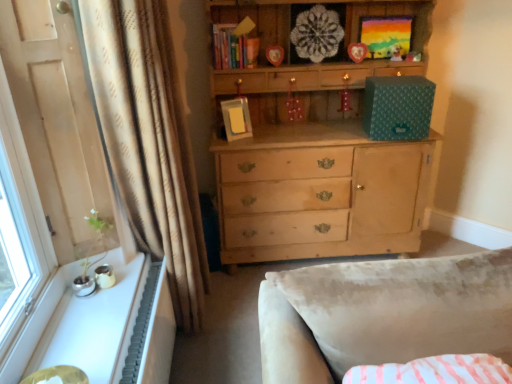
Question: Should I look upward or downward to see white glossy windowsill at lower left?

Choices:
 (A) down
 (B) up

Answer: (A)

Question: Is white textured radiator at lower left aimed at white glossy windowsill at lower left?

Choices:
 (A) yes
 (B) no

Answer: (B)

Question: Can you confirm if white textured radiator at lower left is taller than white glossy windowsill at lower left?

Choices:
 (A) yes
 (B) no

Answer: (A)

Question: Does white textured radiator at lower left have a lesser height compared to white glossy windowsill at lower left?

Choices:
 (A) yes
 (B) no

Answer: (B)

Question: Is white textured radiator at lower left not within white glossy windowsill at lower left?

Choices:
 (A) no
 (B) yes

Answer: (B)

Question: Can you confirm if white textured radiator at lower left is bigger than white glossy windowsill at lower left?

Choices:
 (A) yes
 (B) no

Answer: (A)

Question: From the image's perspective, is white textured radiator at lower left below white glossy windowsill at lower left?

Choices:
 (A) yes
 (B) no

Answer: (A)

Question: Is plush yellow teddy bear at upper center bigger than beige textured curtain at left?

Choices:
 (A) no
 (B) yes

Answer: (A)

Question: Is plush yellow teddy bear at upper center positioned in front of beige textured curtain at left?

Choices:
 (A) no
 (B) yes

Answer: (A)

Question: Does plush yellow teddy bear at upper center have a greater height compared to beige textured curtain at left?

Choices:
 (A) yes
 (B) no

Answer: (B)

Question: Can you confirm if plush yellow teddy bear at upper center is shorter than beige textured curtain at left?

Choices:
 (A) no
 (B) yes

Answer: (B)

Question: Is plush yellow teddy bear at upper center at the left side of beige textured curtain at left?

Choices:
 (A) no
 (B) yes

Answer: (A)

Question: Is plush yellow teddy bear at upper center outside of beige textured curtain at left?

Choices:
 (A) yes
 (B) no

Answer: (A)

Question: Does plush yellow teddy bear at upper center have a lesser height compared to white textured radiator at lower left?

Choices:
 (A) no
 (B) yes

Answer: (B)